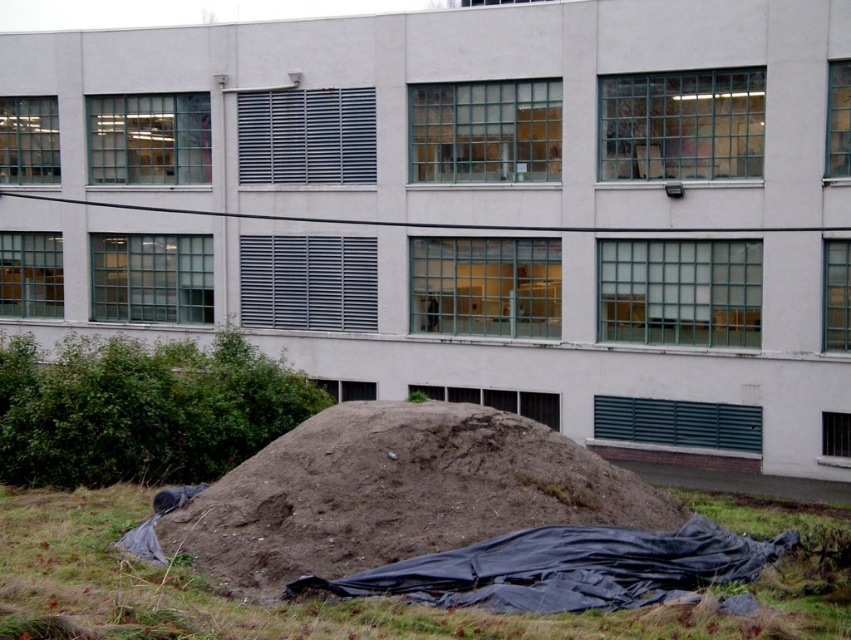
Question: Which object appears farthest from the camera in this image?

Choices:
 (A) brown dirt mound at lower center
 (B) brown grass at lower center

Answer: (A)

Question: Can you confirm if brown dirt mound at lower center is positioned above brown grass at lower center?

Choices:
 (A) no
 (B) yes

Answer: (B)

Question: Is brown dirt mound at lower center wider than brown grass at lower center?

Choices:
 (A) yes
 (B) no

Answer: (B)

Question: Which object is closer to the camera taking this photo?

Choices:
 (A) brown grass at lower center
 (B) brown dirt mound at lower center

Answer: (A)

Question: Can you confirm if brown dirt mound at lower center is positioned above brown grass at lower center?

Choices:
 (A) yes
 (B) no

Answer: (A)

Question: Which of the following is the closest to the observer?

Choices:
 (A) (728, 506)
 (B) (484, 476)

Answer: (B)